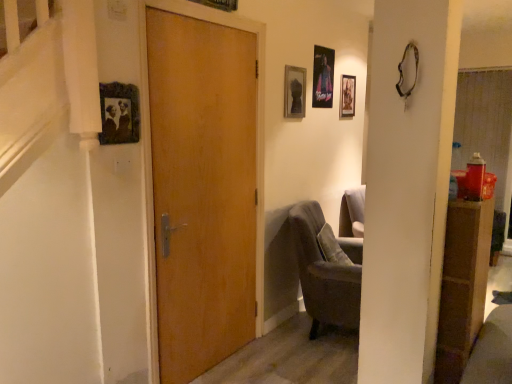
Question: Is matte glass picture frame at upper center, which appears as the third picture frame when viewed from the right, behind matte black picture frame at upper left, arranged as the 1th picture frame when viewed from the front?

Choices:
 (A) yes
 (B) no

Answer: (A)

Question: From a real-world perspective, is matte glass picture frame at upper center, which appears as the third picture frame when viewed from the right, beneath matte black picture frame at upper left, arranged as the 1th picture frame when viewed from the front?

Choices:
 (A) no
 (B) yes

Answer: (A)

Question: Is matte glass picture frame at upper center, which appears as the third picture frame when viewed from the right, next to matte black picture frame at upper left, the 5th picture frame in the right-to-left sequence, and touching it?

Choices:
 (A) no
 (B) yes

Answer: (A)

Question: From the image's perspective, is matte glass picture frame at upper center, arranged as the 3th picture frame when viewed from the left, over matte black picture frame at upper left, the 5th picture frame in the right-to-left sequence?

Choices:
 (A) yes
 (B) no

Answer: (A)

Question: Is matte glass picture frame at upper center, which is counted as the third picture frame, starting from the front, surrounding matte black picture frame at upper left, arranged as the 5th picture frame when viewed from the back?

Choices:
 (A) no
 (B) yes

Answer: (A)

Question: From the image's perspective, is wooden picture frame at upper center, marked as the fourth picture frame in a back-to-front arrangement, positioned above or below matte black picture frame at upper center, the 5th picture frame from the front?

Choices:
 (A) above
 (B) below

Answer: (A)

Question: Based on their sizes in the image, would you say wooden picture frame at upper center, marked as the fourth picture frame in a back-to-front arrangement, is bigger or smaller than matte black picture frame at upper center, which is the first picture frame from back to front?

Choices:
 (A) small
 (B) big

Answer: (B)

Question: Is wooden picture frame at upper center, marked as the 2th picture frame in a left-to-right arrangement, wider or thinner than matte black picture frame at upper center, the fifth picture frame in the left-to-right sequence?

Choices:
 (A) thin
 (B) wide

Answer: (B)

Question: Based on their positions, is wooden picture frame at upper center, marked as the 2th picture frame in a left-to-right arrangement, located to the left or right of matte black picture frame at upper center, the 5th picture frame from the front?

Choices:
 (A) right
 (B) left

Answer: (B)

Question: Based on their sizes in the image, would you say wooden picture frame at upper center, marked as the fourth picture frame in a back-to-front arrangement, is bigger or smaller than wooden door at center?

Choices:
 (A) big
 (B) small

Answer: (B)

Question: From a real-world perspective, is wooden picture frame at upper center, marked as the 2th picture frame in a left-to-right arrangement, above or below wooden door at center?

Choices:
 (A) above
 (B) below

Answer: (A)

Question: Is wooden picture frame at upper center, marked as the fourth picture frame in a back-to-front arrangement, wider or thinner than wooden door at center?

Choices:
 (A) thin
 (B) wide

Answer: (A)

Question: Is point (202, 3) positioned closer to the camera than point (251, 44)?

Choices:
 (A) closer
 (B) farther

Answer: (A)

Question: Based on their sizes in the image, would you say metallic poster at upper center, acting as the fourth picture frame starting from the front, is bigger or smaller than velvet grey armchair at lower right?

Choices:
 (A) big
 (B) small

Answer: (B)

Question: Is metallic poster at upper center, acting as the fourth picture frame starting from the front, spatially inside velvet grey armchair at lower right, or outside of it?

Choices:
 (A) outside
 (B) inside

Answer: (A)